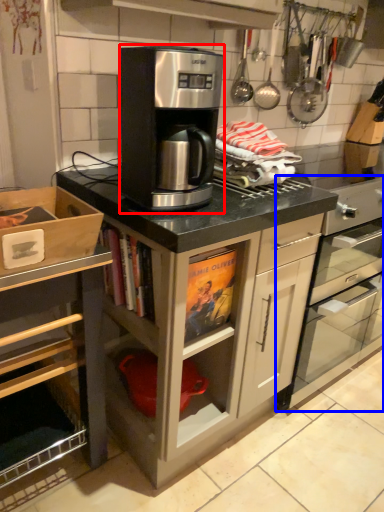
Question: Which object appears closest to the camera in this image, kitchen appliance (highlighted by a red box) or home appliance (highlighted by a blue box)?

Choices:
 (A) kitchen appliance
 (B) home appliance

Answer: (A)